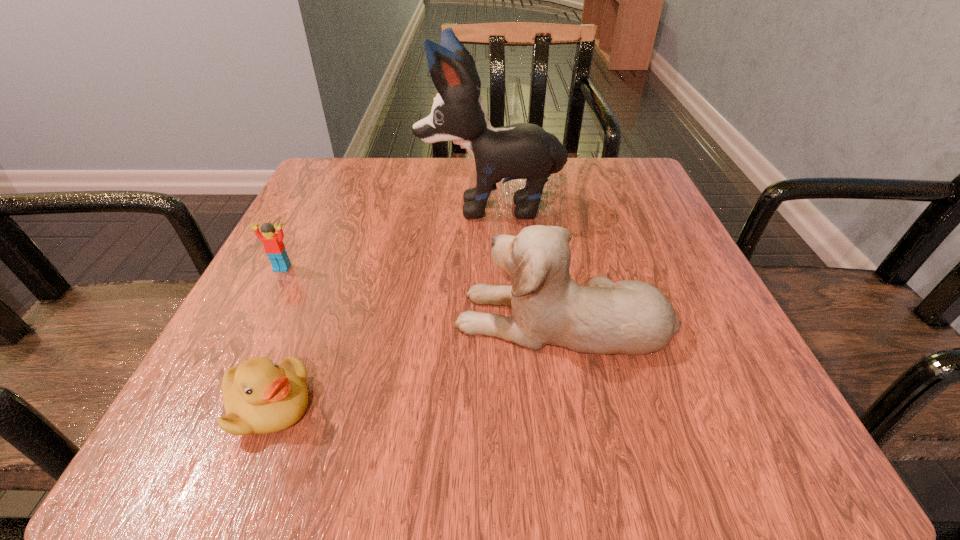
Where is `the taller puppy`? the taller puppy is located at coordinates (526, 151).

Find the location of a particular element. The height and width of the screenshot is (540, 960). the tallest object is located at coordinates (526, 151).

What are the coordinates of `the nearer puppy` in the screenshot? It's located at (631, 317).

Where is `the third farthest object`? The image size is (960, 540). the third farthest object is located at coordinates (631, 317).

This screenshot has width=960, height=540. Identify the location of Lego. (274, 247).

Locate an element on the screen. The image size is (960, 540). duckling is located at coordinates (260, 397).

Locate an element on the screen. vacant space located 0.210m on the front-facing side of the farthest object is located at coordinates (317, 205).

You are a GUI agent. You are given a task and a screenshot of the screen. Output one action in this format:
    pyautogui.click(x=<x>, y=<y>)
    Task: Click on the free space located on the front-facing side of the farthest object
    The width and height of the screenshot is (960, 540).
    Given the screenshot: What is the action you would take?
    pyautogui.click(x=312, y=205)

This screenshot has width=960, height=540. I want to click on free space located on the front-facing side of the farthest object, so click(x=337, y=205).

This screenshot has height=540, width=960. In order to click on vacant space situated 0.160m on the front-facing side of the nearer puppy in this screenshot , I will do `click(348, 318)`.